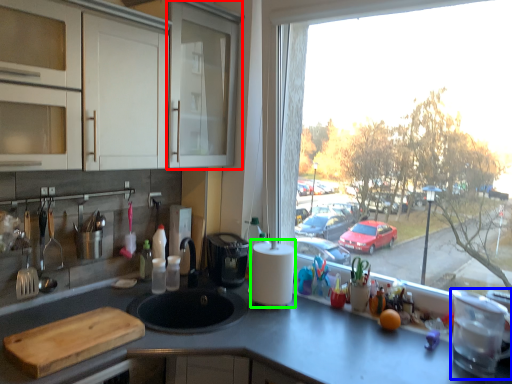
Question: Which is nearer to the screen door (highlighted by a red box)? appliance (highlighted by a blue box) or paper towel (highlighted by a green box).

Choices:
 (A) appliance
 (B) paper towel

Answer: (B)